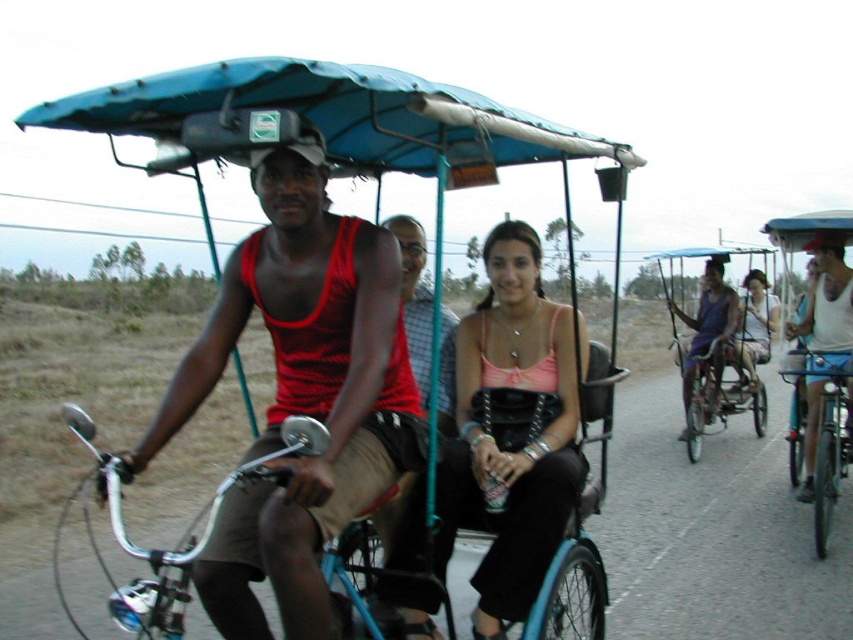
Does red tank top at center have a lesser width compared to matte red tank top at center?

No.

Is red tank top at center smaller than matte red tank top at center?

Incorrect, red tank top at center is not smaller in size than matte red tank top at center.

Who is more distant from viewer, (x=231, y=589) or (x=381, y=529)?

The point (x=381, y=529) is more distant.

This screenshot has width=853, height=640. Find the location of `red tank top at center`. red tank top at center is located at coordinates (300, 394).

The width and height of the screenshot is (853, 640). What do you see at coordinates (525, 442) in the screenshot?
I see `pink fabric purse at center` at bounding box center [525, 442].

Where is `pink fabric purse at center`? This screenshot has height=640, width=853. pink fabric purse at center is located at coordinates (525, 442).

Does point (558, 470) come in front of point (402, 241)?

Yes, point (558, 470) is closer to viewer.

Locate an element on the screen. This screenshot has height=640, width=853. pink fabric purse at center is located at coordinates (525, 442).

Does pink fabric purse at center appear under metallic blue bicycle at right?

No.

Between point (540, 570) and point (805, 368), which one is positioned behind?

Positioned behind is point (805, 368).

This screenshot has width=853, height=640. I want to click on pink fabric purse at center, so click(x=525, y=442).

This screenshot has width=853, height=640. What are the coordinates of `pink fabric purse at center` in the screenshot? It's located at (525, 442).